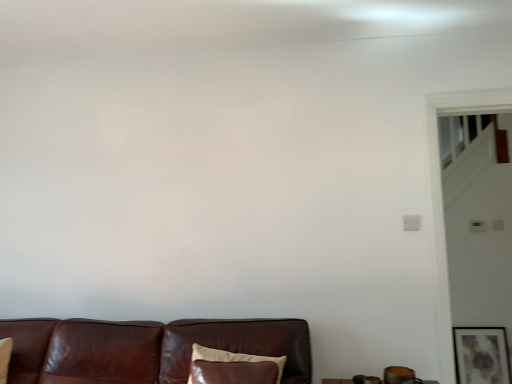
Question: Is brown leather couch at lower center smaller than matte gray painting at lower right?

Choices:
 (A) yes
 (B) no

Answer: (B)

Question: Considering the relative sizes of brown leather couch at lower center and matte gray painting at lower right in the image provided, is brown leather couch at lower center taller than matte gray painting at lower right?

Choices:
 (A) yes
 (B) no

Answer: (B)

Question: Considering the relative sizes of brown leather couch at lower center and matte gray painting at lower right in the image provided, is brown leather couch at lower center wider than matte gray painting at lower right?

Choices:
 (A) yes
 (B) no

Answer: (A)

Question: Can you confirm if brown leather couch at lower center is thinner than matte gray painting at lower right?

Choices:
 (A) no
 (B) yes

Answer: (A)

Question: Is brown leather couch at lower center to the left of matte gray painting at lower right from the viewer's perspective?

Choices:
 (A) no
 (B) yes

Answer: (B)

Question: From a real-world perspective, is matte gray painting at lower right physically located above or below brown leather pillow at lower center?

Choices:
 (A) below
 (B) above

Answer: (A)

Question: Is matte gray painting at lower right bigger or smaller than brown leather pillow at lower center?

Choices:
 (A) big
 (B) small

Answer: (B)

Question: In the image, is matte gray painting at lower right positioned in front of or behind brown leather pillow at lower center?

Choices:
 (A) behind
 (B) front

Answer: (A)

Question: Does point (485, 380) appear closer or farther from the camera than point (230, 380)?

Choices:
 (A) closer
 (B) farther

Answer: (B)

Question: Looking at the image, does brown leather pillow at lower center seem bigger or smaller compared to brown leather couch at lower center?

Choices:
 (A) big
 (B) small

Answer: (B)

Question: Is point (215, 365) positioned closer to the camera than point (125, 337)?

Choices:
 (A) closer
 (B) farther

Answer: (A)

Question: From the image's perspective, relative to brown leather couch at lower center, is brown leather pillow at lower center above or below?

Choices:
 (A) above
 (B) below

Answer: (A)

Question: Based on their positions, is brown leather pillow at lower center located to the left or right of brown leather couch at lower center?

Choices:
 (A) left
 (B) right

Answer: (B)

Question: From the image's perspective, relative to matte gray painting at lower right, is brown leather pillow at lower center above or below?

Choices:
 (A) below
 (B) above

Answer: (B)

Question: Is brown leather pillow at lower center bigger or smaller than matte gray painting at lower right?

Choices:
 (A) small
 (B) big

Answer: (B)